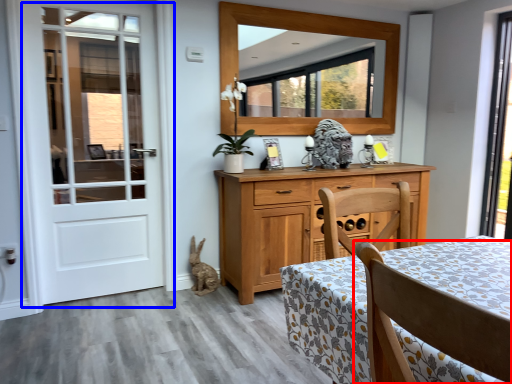
Question: Which point is further to the camera, chair (highlighted by a red box) or door (highlighted by a blue box)?

Choices:
 (A) chair
 (B) door

Answer: (B)